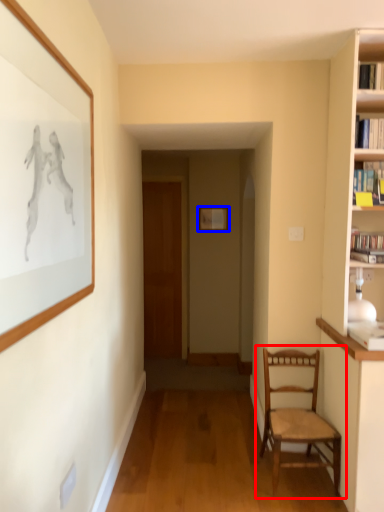
Question: Among these objects, which one is farthest to the camera, chair (highlighted by a red box) or picture frame (highlighted by a blue box)?

Choices:
 (A) chair
 (B) picture frame

Answer: (B)